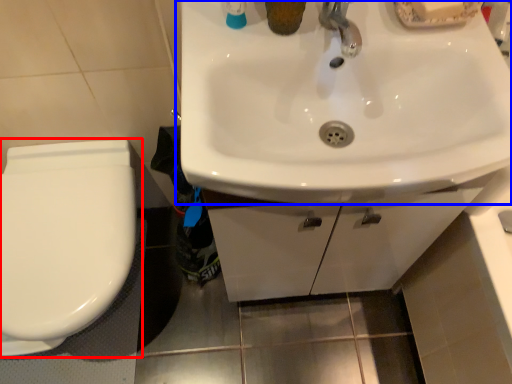
Question: Which point is further to the camera, toilet (highlighted by a red box) or sink (highlighted by a blue box)?

Choices:
 (A) toilet
 (B) sink

Answer: (A)